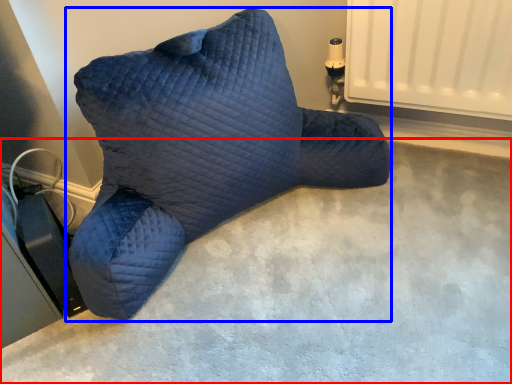
Question: Which of the following is the farthest to the observer, concrete (highlighted by a red box) or furniture (highlighted by a blue box)?

Choices:
 (A) concrete
 (B) furniture

Answer: (B)